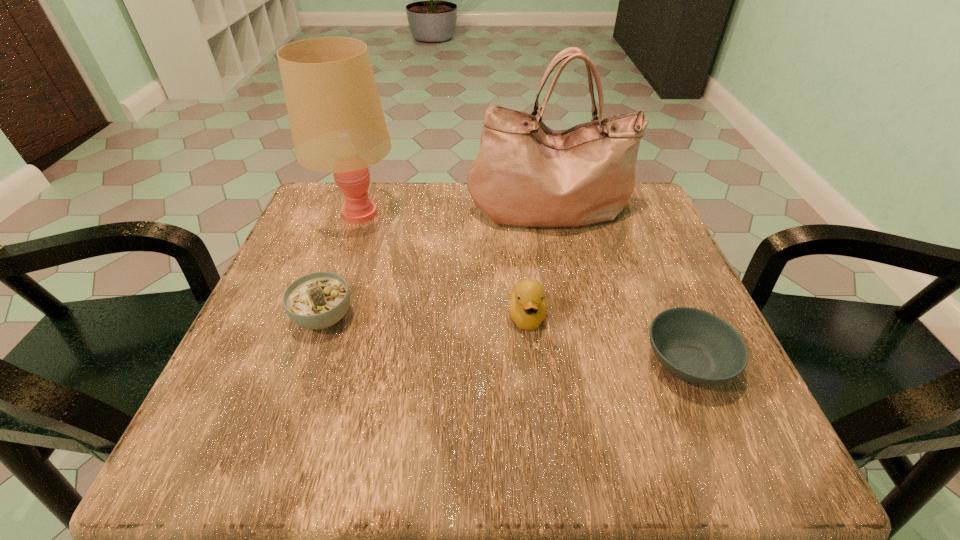
This screenshot has width=960, height=540. In the image, there is a desktop. Find the location of `blank space at the far edge`. blank space at the far edge is located at coordinates (462, 202).

Image resolution: width=960 pixels, height=540 pixels. Find the location of `free spot at the near edge of the desktop`. free spot at the near edge of the desktop is located at coordinates (508, 470).

This screenshot has width=960, height=540. In the image, there is a desktop. Identify the location of vacant space at the left edge. (x=289, y=278).

You are a GUI agent. You are given a task and a screenshot of the screen. Output one action in this format:
    pyautogui.click(x=<x>, y=<y>)
    Task: Click on the blank area at the right edge
    The image size is (960, 540).
    Given the screenshot: What is the action you would take?
    pyautogui.click(x=652, y=315)

Image resolution: width=960 pixels, height=540 pixels. I want to click on free region at the far left corner of the desktop, so click(x=324, y=235).

I want to click on vacant space at the far right corner of the desktop, so click(x=643, y=231).

Where is `vacant space at the near right corner of the desktop`? The width and height of the screenshot is (960, 540). vacant space at the near right corner of the desktop is located at coordinates (763, 462).

I want to click on free space between the handbag and the third shortest object, so click(x=539, y=263).

Find the location of `vacant space that is in between the right soup bowl and the handbag`. vacant space that is in between the right soup bowl and the handbag is located at coordinates (618, 286).

The height and width of the screenshot is (540, 960). I want to click on free space between the lampshade and the fourth tallest object, so click(x=341, y=265).